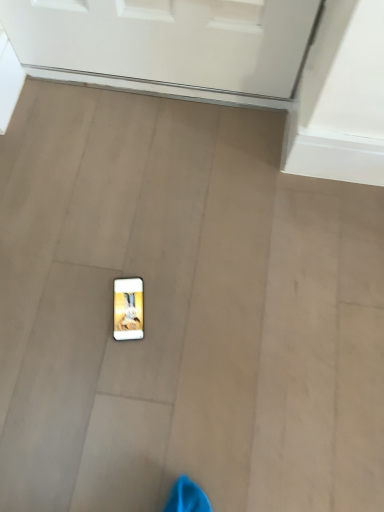
What do you see at coordinates (128, 309) in the screenshot? I see `matte white phone at center` at bounding box center [128, 309].

At what (x,y) coordinates should I click in order to perform the action: click on matte white phone at center. Please return your answer as a coordinate pair (x, y). This screenshot has width=384, height=512. Looking at the image, I should click on (128, 309).

Measure the distance between point (140, 286) and camera.

→ 3.62 feet.

Find the location of a particular element. matte white phone at center is located at coordinates (128, 309).